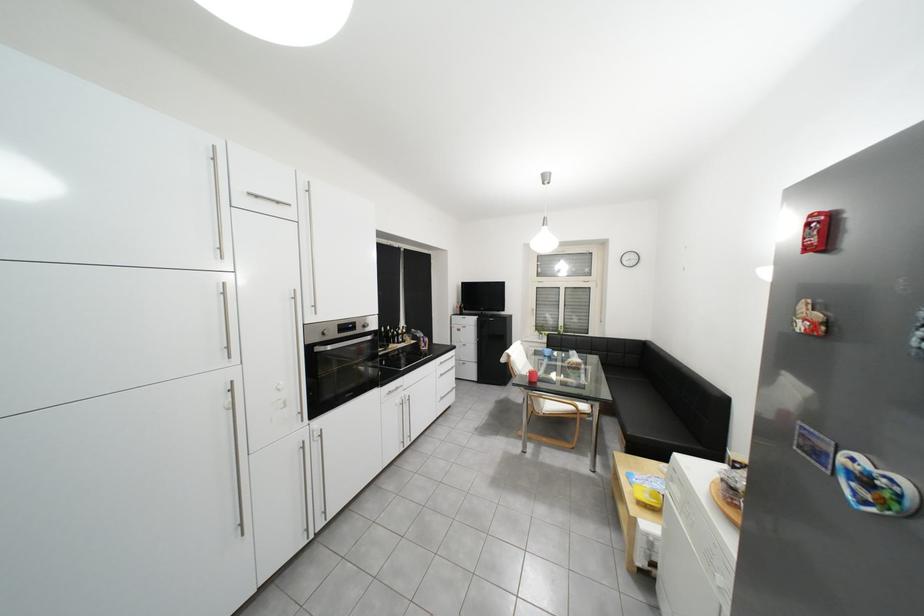
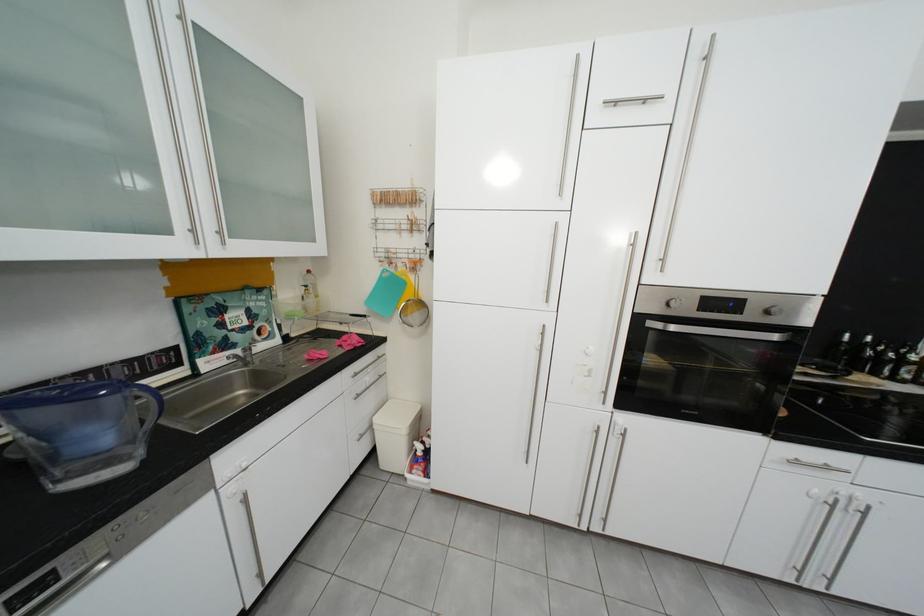
Locate, in the second image, the point that corresponds to [321,349] in the first image.

(650, 320)